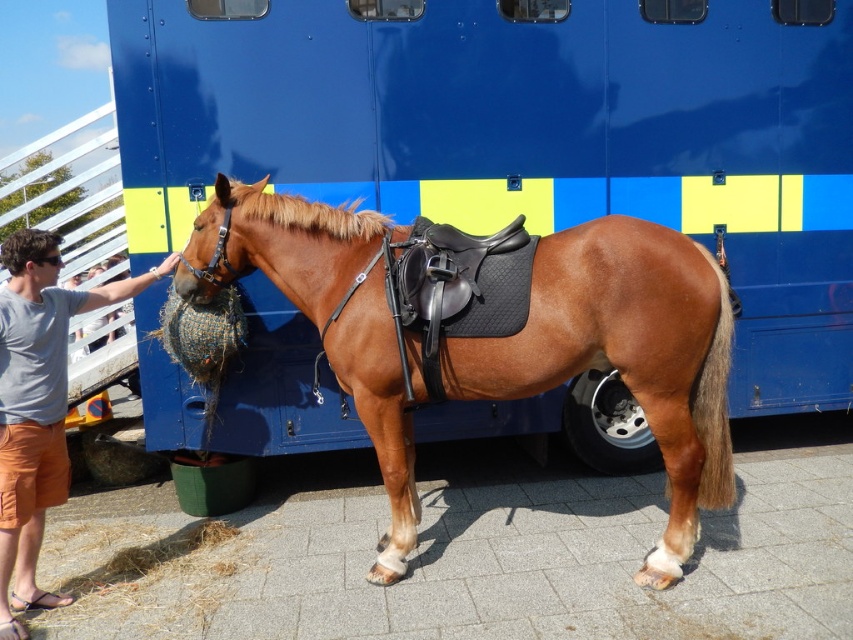
You are a photographer positioned behind the light blue cotton shirt at left and want to take a photo of the brown glossy horse at center. Can you see the entire horse without moving your position? Explain why.

The brown glossy horse at center is further to the viewer than light blue cotton shirt at left. Since the horse is closer to you, it would block your view of the person behind it, but since you are behind the person, the light blue cotton shirt at left would block your view of the horse unless you move closer or adjust your angle. However, since the horse is closer to you, you might still see most of it unless the person is directly in front. But according to the description, the horse is further to the. 2

You are a horse trainer who needs to approach the brown glossy horse at center to check its saddle. The light blue cotton shirt at left is another trainer who is already near the horse. Since you are 1.8 meters tall, can you safely reach the saddle without needing to move closer than the other trainer?

The distance between the brown glossy horse at center and the light blue cotton shirt at left is 1.27 meters. Since you are 1.8 meters tall, you can safely reach the saddle without needing to move closer than the other trainer, as the distance allows for comfortable interaction while maintaining space.

You are a photographer trying to capture a photo of the brown glossy horse at center and the light blue cotton shirt at left. If you want to ensure both subjects are in focus, which one should you adjust your camera focus on first based on their sizes?

The brown glossy horse at center is larger than the light blue cotton shirt at left, so you should focus on the brown glossy horse at center first to ensure both are in focus.